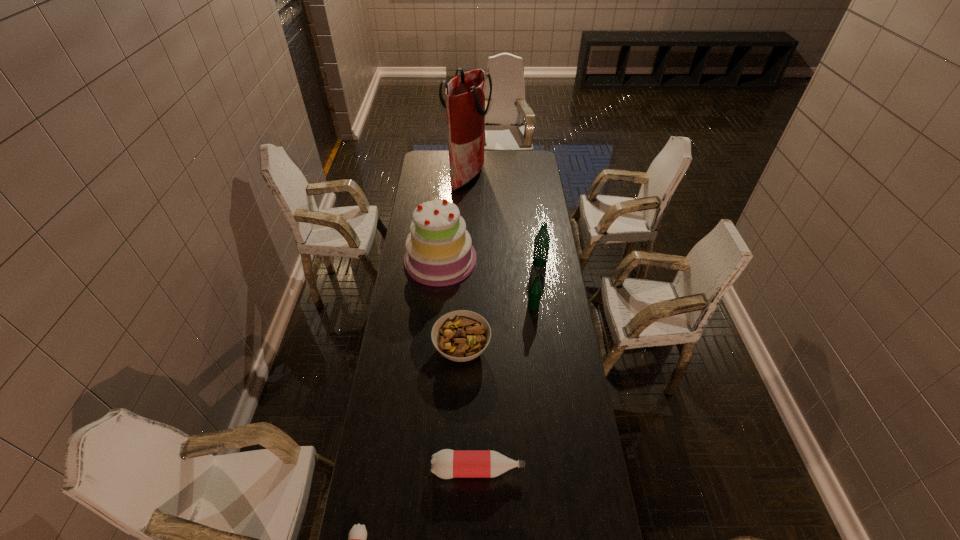
I want to click on vacant space at the left edge of the desktop, so click(x=415, y=185).

Locate an element on the screen. Image resolution: width=960 pixels, height=540 pixels. vacant position at the right edge of the desktop is located at coordinates (563, 357).

Locate an element on the screen. Image resolution: width=960 pixels, height=540 pixels. free space at the far left corner of the desktop is located at coordinates (444, 164).

I want to click on unoccupied position between the farther green bottle and the gray stew, so click(x=501, y=306).

Where is `blank region between the fourth tallest object and the stew`? blank region between the fourth tallest object and the stew is located at coordinates (497, 327).

Identify the location of empty location between the purple cake and the fourth nearest object. click(487, 284).

Identify which object is located as the third nearest to the leftmost bottle. Please provide its 2D coordinates. Your answer should be formatted as a tuple, i.e. [(x, y)], where the tuple contains the x and y coordinates of a point satisfying the conditions above.

[(439, 252)]

The height and width of the screenshot is (540, 960). What are the coordinates of `the sixth closest object to the second nearest bottle` in the screenshot? It's located at (465, 94).

Where is `the closest bottle relative to the farther pink bottle`? The height and width of the screenshot is (540, 960). the closest bottle relative to the farther pink bottle is located at coordinates (357, 536).

In order to click on bottle that stands as the fourth closest to the cake in this screenshot , I will do `click(357, 536)`.